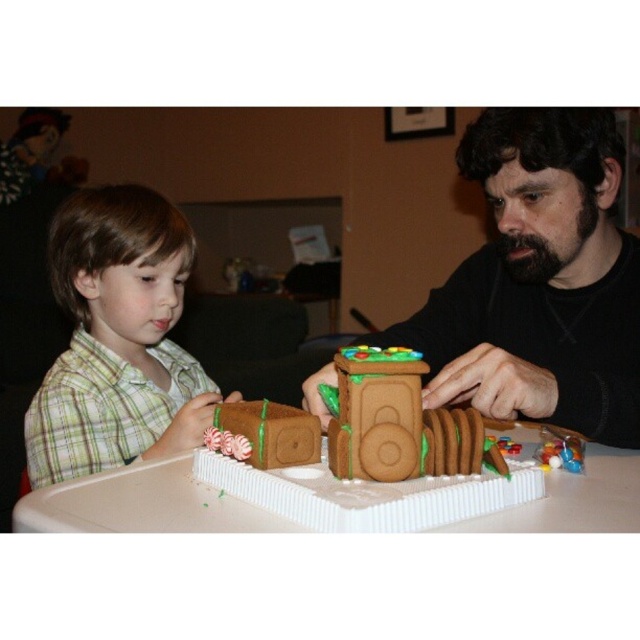
The width and height of the screenshot is (640, 640). Identify the location of green plaid shirt at left. click(116, 339).

Which of these two, green plaid shirt at left or brown sugar cookie at center, stands taller?

Standing taller between the two is green plaid shirt at left.

The width and height of the screenshot is (640, 640). Find the location of `green plaid shirt at left`. green plaid shirt at left is located at coordinates (116, 339).

Between black matte gingerbread house at right and green plaid shirt at left, which one appears on the right side from the viewer's perspective?

A: From the viewer's perspective, black matte gingerbread house at right appears more on the right side.

Which of these two, black matte gingerbread house at right or green plaid shirt at left, stands shorter?

With less height is black matte gingerbread house at right.

The image size is (640, 640). I want to click on black matte gingerbread house at right, so click(540, 282).

Identify the location of black matte gingerbread house at right. Image resolution: width=640 pixels, height=640 pixels. (540, 282).

Who is shorter, green plaid shirt at left or brown sugar cookie train at center?

brown sugar cookie train at center

Which is more to the left, green plaid shirt at left or brown sugar cookie train at center?

Positioned to the left is green plaid shirt at left.

This screenshot has width=640, height=640. Describe the element at coordinates (116, 339) in the screenshot. I see `green plaid shirt at left` at that location.

This screenshot has height=640, width=640. I want to click on green plaid shirt at left, so click(116, 339).